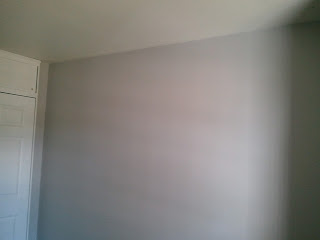
This screenshot has width=320, height=240. Identify the location of molding. (34, 64).